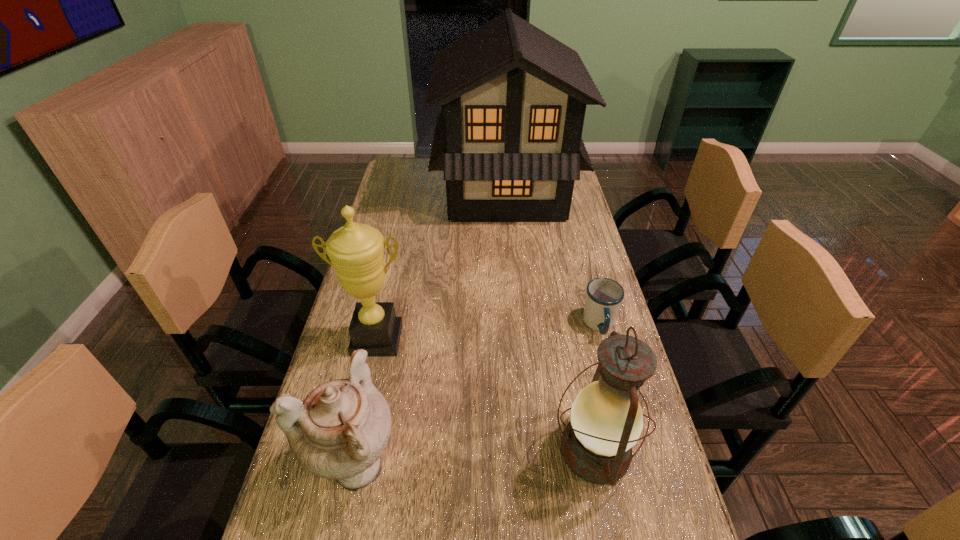
Where is `dollhouse`? The image size is (960, 540). dollhouse is located at coordinates (509, 138).

Where is `the farthest object`? The height and width of the screenshot is (540, 960). the farthest object is located at coordinates (509, 138).

Locate an element on the screen. trophy cup is located at coordinates (356, 251).

Locate an element on the screen. oil lamp is located at coordinates (606, 421).

Where is `the fourth tallest object`? This screenshot has width=960, height=540. the fourth tallest object is located at coordinates (339, 432).

You are a GUI agent. You are given a task and a screenshot of the screen. Output one action in this format:
    pyautogui.click(x=<x>, y=<y>)
    Task: Click on the mug
    
    Given the screenshot: What is the action you would take?
    pyautogui.click(x=604, y=296)

At what (x,y) coordinates should I click in order to perform the action: click on vacant space located on the front-facing side of the tallest object. Please return your answer as a coordinate pair (x, y). Looking at the image, I should click on (405, 191).

Where is `free location located 0.170m on the front-facing side of the tallest object`? This screenshot has height=540, width=960. free location located 0.170m on the front-facing side of the tallest object is located at coordinates (393, 191).

The width and height of the screenshot is (960, 540). In order to click on free space located 0.140m on the front-facing side of the tallest object in this screenshot , I will do `click(400, 191)`.

You are a GUI agent. You are given a task and a screenshot of the screen. Output one action in this format:
    pyautogui.click(x=<x>, y=<y>)
    Task: Click on the free space located 0.100m at the front of the trophy cup with handles
    The width and height of the screenshot is (960, 540).
    Given the screenshot: What is the action you would take?
    pyautogui.click(x=365, y=392)